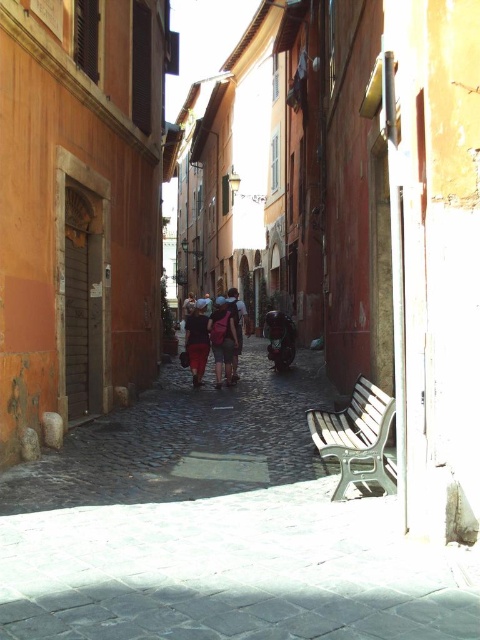
Question: Which object is the closest to the matte purple backpack at center?

Choices:
 (A) matte black backpack at center
 (B) green fabric baby carriage at center
 (C) dark blue fabric at center

Answer: (A)

Question: Which is farther from the matte purple backpack at center?

Choices:
 (A) matte black backpack at center
 (B) white plastic bench at lower right
 (C) green fabric baby carriage at center
 (D) dark brown leather backpack at center

Answer: (B)

Question: Can you confirm if dark brown leather backpack at center is positioned above green fabric baby carriage at center?

Choices:
 (A) yes
 (B) no

Answer: (A)

Question: Is matte black backpack at center closer to camera compared to matte purple backpack at center?

Choices:
 (A) yes
 (B) no

Answer: (B)

Question: Which point is farther to the camera?

Choices:
 (A) (207, 352)
 (B) (214, 308)
 (C) (286, 348)
 (D) (237, 372)

Answer: (B)

Question: Does white plastic bench at lower right appear under matte purple backpack at center?

Choices:
 (A) yes
 (B) no

Answer: (A)